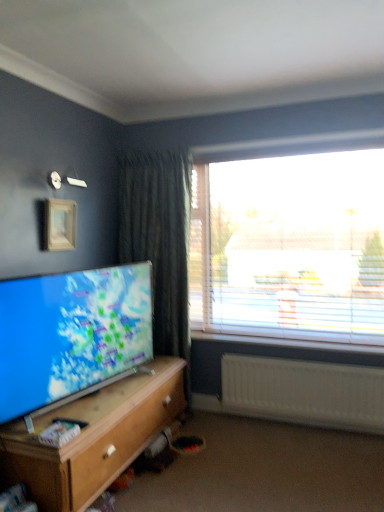
Question: Considering the relative sizes of wooden cabinet at lower left and matte screen tv at lower left in the image provided, is wooden cabinet at lower left taller than matte screen tv at lower left?

Choices:
 (A) yes
 (B) no

Answer: (B)

Question: Considering the relative positions of wooden cabinet at lower left and matte screen tv at lower left in the image provided, is wooden cabinet at lower left in front of matte screen tv at lower left?

Choices:
 (A) yes
 (B) no

Answer: (A)

Question: Is wooden cabinet at lower left aimed at matte screen tv at lower left?

Choices:
 (A) yes
 (B) no

Answer: (B)

Question: Is wooden cabinet at lower left with matte screen tv at lower left?

Choices:
 (A) yes
 (B) no

Answer: (B)

Question: From a real-world perspective, is wooden cabinet at lower left on top of matte screen tv at lower left?

Choices:
 (A) yes
 (B) no

Answer: (B)

Question: Is wooden picture frame at upper left bigger or smaller than wooden cabinet at lower left?

Choices:
 (A) big
 (B) small

Answer: (B)

Question: Considering their positions, is wooden picture frame at upper left located in front of or behind wooden cabinet at lower left?

Choices:
 (A) behind
 (B) front

Answer: (A)

Question: Considering the relative positions of wooden picture frame at upper left and wooden cabinet at lower left in the image provided, is wooden picture frame at upper left to the left or to the right of wooden cabinet at lower left?

Choices:
 (A) left
 (B) right

Answer: (A)

Question: Choose the correct answer: Is wooden picture frame at upper left inside wooden cabinet at lower left or outside it?

Choices:
 (A) inside
 (B) outside

Answer: (B)

Question: Looking at their shapes, would you say wooden picture frame at upper left is wider or thinner than black plastic remote control at lower left?

Choices:
 (A) wide
 (B) thin

Answer: (B)

Question: Considering their positions, is wooden picture frame at upper left located in front of or behind black plastic remote control at lower left?

Choices:
 (A) front
 (B) behind

Answer: (B)

Question: Considering the positions of wooden picture frame at upper left and black plastic remote control at lower left in the image, is wooden picture frame at upper left taller or shorter than black plastic remote control at lower left?

Choices:
 (A) short
 (B) tall

Answer: (B)

Question: Would you say wooden picture frame at upper left is inside or outside black plastic remote control at lower left?

Choices:
 (A) inside
 (B) outside

Answer: (B)

Question: Considering the positions of point (41, 422) and point (74, 423), is point (41, 422) closer or farther from the camera than point (74, 423)?

Choices:
 (A) farther
 (B) closer

Answer: (A)

Question: From a real-world perspective, is wooden cabinet at lower left above or below black plastic remote control at lower left?

Choices:
 (A) below
 (B) above

Answer: (A)